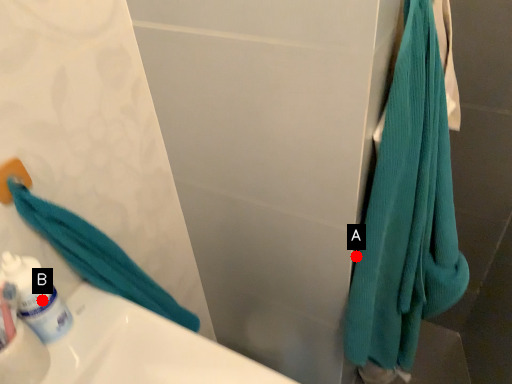
Question: Two points are circled on the image, labeled by A and B beside each circle. Which point appears closest to the camera in this image?

Choices:
 (A) A is closer
 (B) B is closer

Answer: (B)